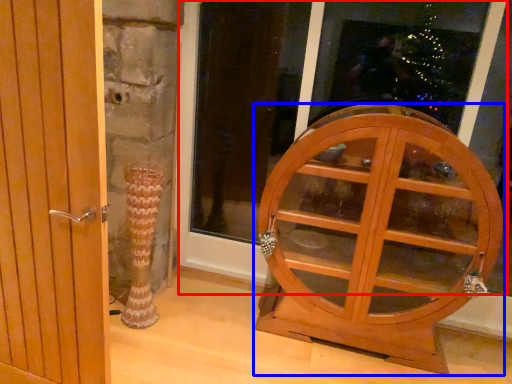
Question: Which object is closer to the camera taking this photo, window frame (highlighted by a red box) or furniture (highlighted by a blue box)?

Choices:
 (A) window frame
 (B) furniture

Answer: (B)